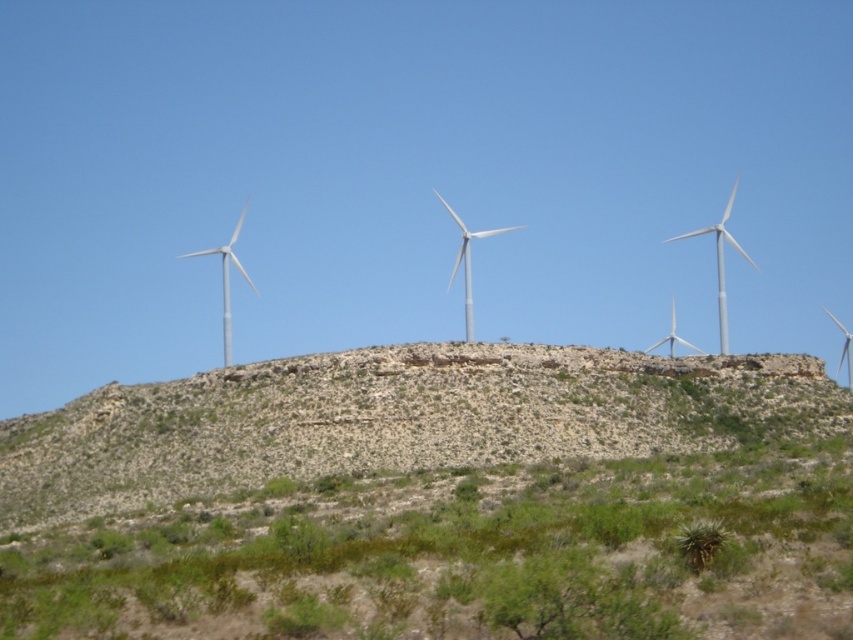
From the picture: You are standing at the base of the hill and want to walk towards the wind turbines. Which one will you reach first, the white metallic wind turbine at upper right or the white matte wind turbine at left?

You will reach the white metallic wind turbine at upper right first because it is closer to you than the white matte wind turbine at left.

You are a drone operator planning to fly a drone from the white metallic wind turbine at upper right to the white matte wind turbine at left. Based on the scene, which direction should you fly the drone to reach the destination?

The white metallic wind turbine at upper right is above the white matte wind turbine at left, so you should fly the drone downward to reach the destination.

From the picture: You are a hiker standing at the base of the rocky hill. You see the green shrubbery at lower center and the white metallic wind turbine at center. Which object is taller?

The green shrubbery at lower center has a lesser height compared to the white metallic wind turbine at center, so the white metallic wind turbine at center is taller.